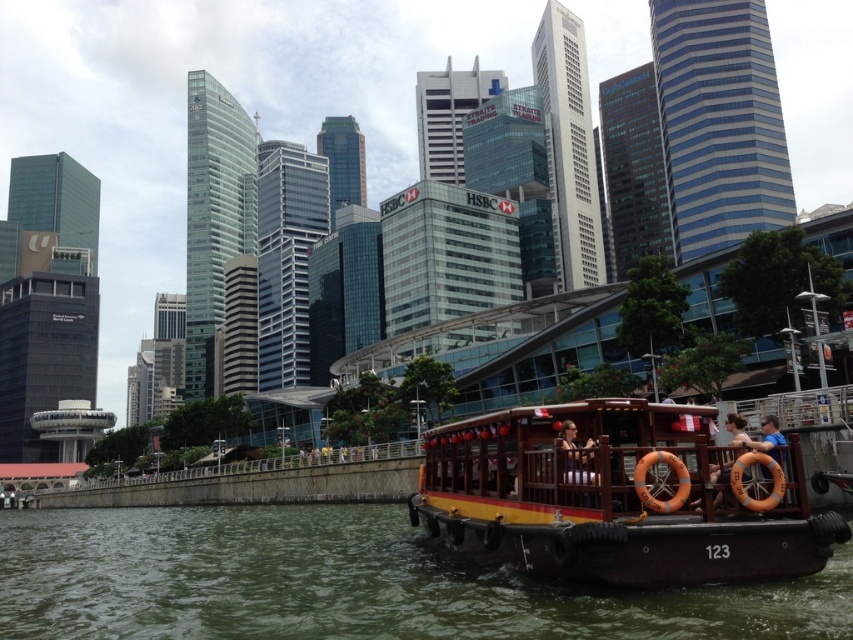
You are a tour guide explaining the scene to visitors. You mention the greenish water at lower left and the wooden boat at lower right. How far apart are these two elements in the image?

The greenish water at lower left and the wooden boat at lower right are 7.03 meters apart from each other.

You are a tourist standing on the dock and see the greenish water at lower left and the wooden boat at lower right. Which one takes up more space in the image?

The greenish water at lower left is bigger than the wooden boat at lower right, so it takes up more space in the image.

You are standing at the boat marked with the number 123 in the foreground of the waterfront scene. Looking towards the HSBC building in the background, which direction should you turn to face the greenish water at lower left represented by point (345,582)?

The greenish water at lower left is located to your left side relative to the HSBC building in the background. To face it, you should turn to your left.